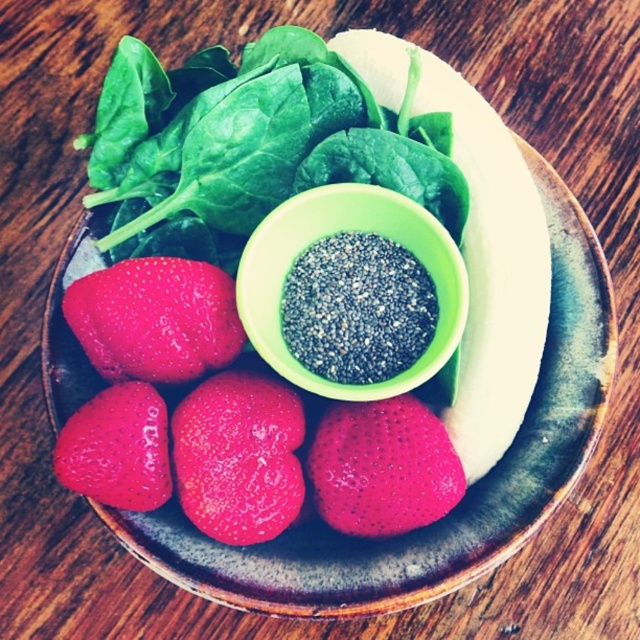
Between green leafy vegetable at upper center and shiny red strawberry at lower left, which one is positioned higher?

green leafy vegetable at upper center is higher up.

Is green leafy vegetable at upper center further to camera compared to shiny red strawberry at lower left?

Yes, green leafy vegetable at upper center is behind shiny red strawberry at lower left.

Identify the location of green leafy vegetable at upper center. The height and width of the screenshot is (640, 640). (259, 148).

Who is shorter, shiny red strawberry at lower left or glossy red strawberry at lower left?

glossy red strawberry at lower left

This screenshot has height=640, width=640. What are the coordinates of `shiny red strawberry at lower left` in the screenshot? It's located at (156, 317).

Does point (141, 344) come closer to viewer compared to point (108, 435)?

No, (141, 344) is further to viewer.

Find the location of `shiny red strawberry at lower left`. shiny red strawberry at lower left is located at coordinates [156, 317].

Is shiny red strawberry at lower left further to camera compared to glossy red strawberry at center?

Yes, shiny red strawberry at lower left is further from the viewer.

Does shiny red strawberry at lower left appear on the right side of glossy red strawberry at center?

In fact, shiny red strawberry at lower left is to the left of glossy red strawberry at center.

Is point (93, 308) in front of point (368, 428)?

Yes.

The image size is (640, 640). Find the location of `shiny red strawberry at lower left`. shiny red strawberry at lower left is located at coordinates (156, 317).